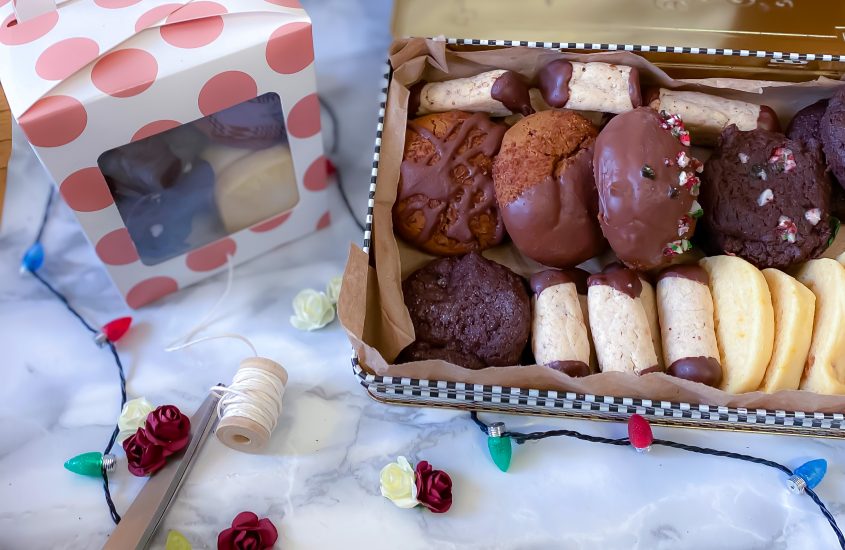
Locate an element on the screen. This screenshot has height=550, width=845. marble counter top is located at coordinates [x=292, y=490].